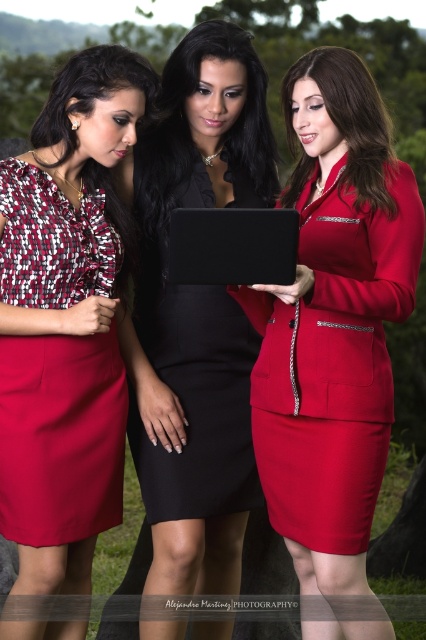
Question: Can you confirm if matte red dress at left is positioned below black satin dress at center?

Choices:
 (A) no
 (B) yes

Answer: (B)

Question: Among these points, which one is farthest from the camera?

Choices:
 (A) click(x=368, y=140)
 (B) click(x=336, y=416)
 (C) click(x=290, y=262)
 (D) click(x=34, y=356)

Answer: (D)

Question: Which object appears farthest from the camera in this image?

Choices:
 (A) black satin dress at center
 (B) matte black dress at center

Answer: (A)

Question: Does matte red dress at left appear over matte black laptop at center?

Choices:
 (A) no
 (B) yes

Answer: (A)

Question: Among these points, which one is farthest from the camera?

Choices:
 (A) [270, 186]
 (B) [201, 486]
 (C) [20, 353]

Answer: (A)

Question: Observing the image, what is the correct spatial positioning of matte black tablet at center in reference to matte black dress at center?

Choices:
 (A) above
 (B) below

Answer: (B)